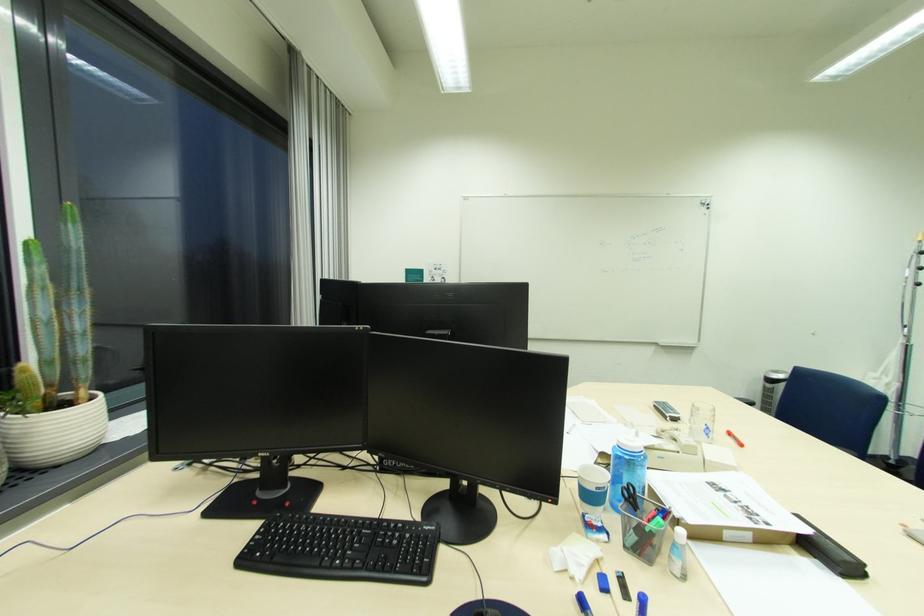
Where is `computer mouse`? The height and width of the screenshot is (616, 924). computer mouse is located at coordinates (488, 609).